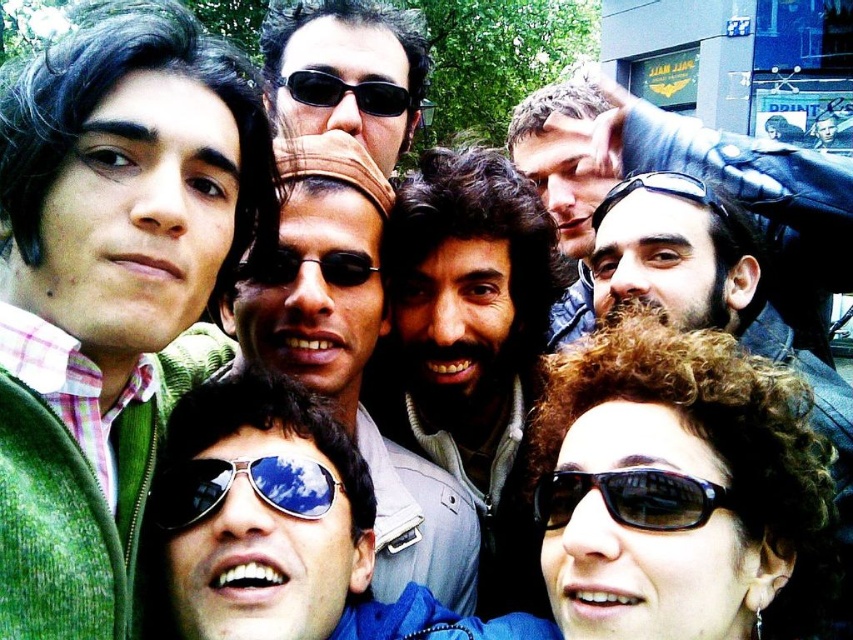
Question: Which point is closer to the camera?

Choices:
 (A) (213, 488)
 (B) (534, 234)

Answer: (A)

Question: Considering the relative positions of smooth leather jacket at upper center and black reflective sunglasses at upper center in the image provided, where is smooth leather jacket at upper center located with respect to black reflective sunglasses at upper center?

Choices:
 (A) above
 (B) below

Answer: (A)

Question: Which of the following is the closest to the observer?

Choices:
 (A) (293, 634)
 (B) (628, 508)
 (C) (672, 172)
 (D) (434, 301)

Answer: (B)

Question: Which of these objects is positioned farthest from the black reflective sunglasses at lower center?

Choices:
 (A) curly hair man at center
 (B) black reflective sunglasses at center

Answer: (B)

Question: In this image, where is smooth leather jacket at upper center located relative to black reflective sunglasses at upper center?

Choices:
 (A) right
 (B) left

Answer: (A)

Question: Where is matte black sunglasses at center located in relation to black reflective sunglasses at upper center in the image?

Choices:
 (A) right
 (B) left

Answer: (B)